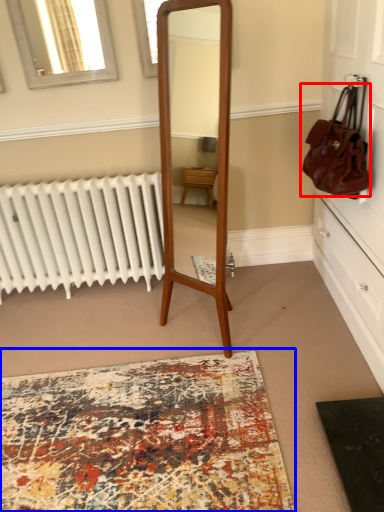
Question: Which object is further to the camera taking this photo, handbag (highlighted by a red box) or mat (highlighted by a blue box)?

Choices:
 (A) handbag
 (B) mat

Answer: (A)